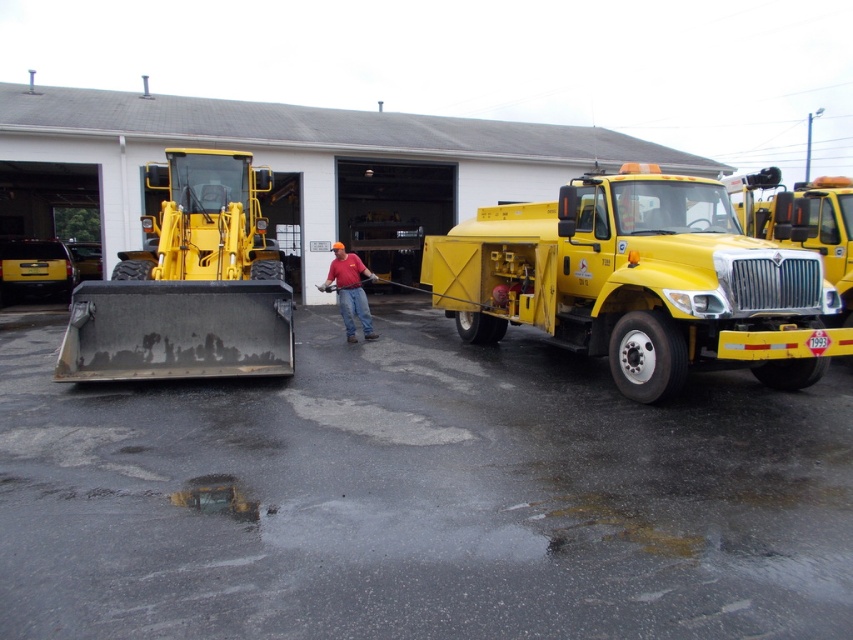
Question: Can you confirm if yellow matte truck at center is bigger than matte black forklift at left?

Choices:
 (A) no
 (B) yes

Answer: (A)

Question: Which point is closer to the camera taking this photo?

Choices:
 (A) (80, 349)
 (B) (660, 321)

Answer: (B)

Question: Considering the relative positions of yellow matte truck at center and matte black forklift at left in the image provided, where is yellow matte truck at center located with respect to matte black forklift at left?

Choices:
 (A) below
 (B) above

Answer: (A)

Question: Which point is farther to the camera?

Choices:
 (A) (172, 237)
 (B) (519, 300)

Answer: (A)

Question: Can you confirm if yellow matte truck at center is thinner than matte black forklift at left?

Choices:
 (A) yes
 (B) no

Answer: (B)